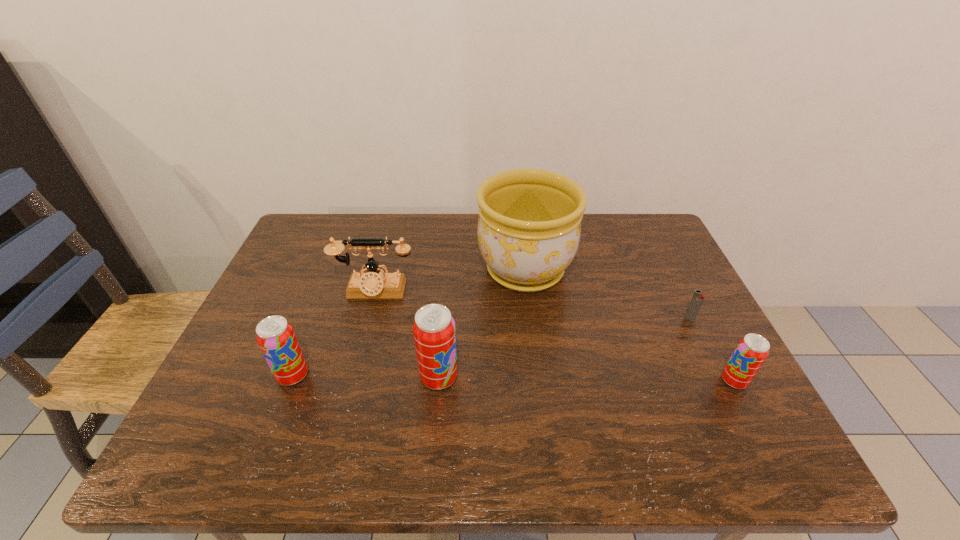
This screenshot has width=960, height=540. I want to click on free space located on the right of the second tallest soda can, so click(x=397, y=375).

Where is `free space located on the back of the tallest soda can`? The image size is (960, 540). free space located on the back of the tallest soda can is located at coordinates (447, 275).

The image size is (960, 540). Find the location of `vacant position located on the left of the shortest soda can`. vacant position located on the left of the shortest soda can is located at coordinates (556, 381).

Locate an element on the screen. vacant space located on the front of the flowerpot is located at coordinates (540, 391).

I want to click on vacant space located on the dial of the telephone, so click(341, 418).

Where is `free space located 0.390m on the left of the fourth nearest object`? This screenshot has height=540, width=960. free space located 0.390m on the left of the fourth nearest object is located at coordinates (533, 319).

Image resolution: width=960 pixels, height=540 pixels. I want to click on object positioned at the far edge, so click(529, 226).

You are a GUI agent. You are given a task and a screenshot of the screen. Output one action in this format:
    pyautogui.click(x=<x>, y=<y>)
    Task: Click on the object at the left edge
    
    Given the screenshot: What is the action you would take?
    pyautogui.click(x=276, y=338)

I want to click on soda can that is at the right edge, so click(x=750, y=353).

Where is `igniter situated at the right edge`? igniter situated at the right edge is located at coordinates (698, 297).